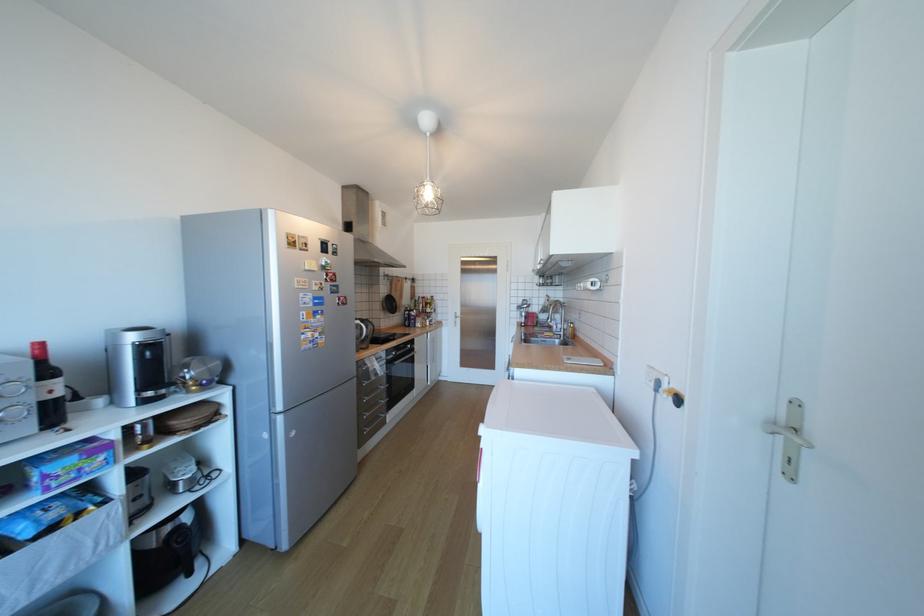
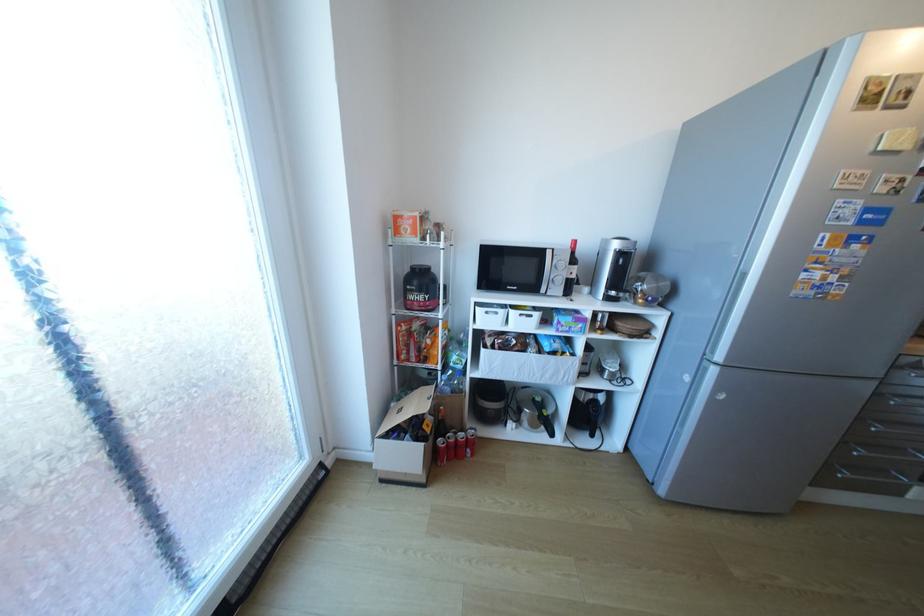
In the second image, find the point that corresponds to pixel 184 544 in the first image.

(600, 408)